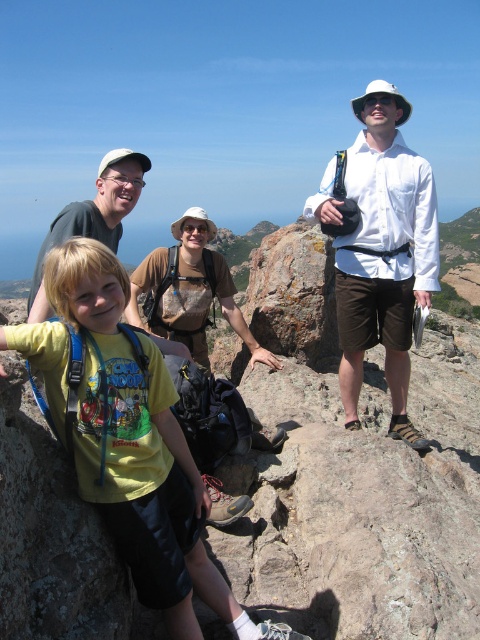
Is white cotton shirt at center below matte green shirt at center?

Yes, white cotton shirt at center is below matte green shirt at center.

Does white cotton shirt at center come in front of matte green shirt at center?

No, it is behind matte green shirt at center.

This screenshot has height=640, width=480. What are the coordinates of `white cotton shirt at center` in the screenshot? It's located at [x=381, y=250].

Is yellow cotton shirt at center to the left of matte green shirt at center from the viewer's perspective?

In fact, yellow cotton shirt at center is to the right of matte green shirt at center.

Between point (146, 460) and point (130, 157), which one is positioned behind?

Point (130, 157)

Where is `yellow cotton shirt at center`? yellow cotton shirt at center is located at coordinates (130, 442).

Is point (118, 385) farther from camera compared to point (360, 131)?

No, (118, 385) is closer to viewer.

Is yellow cotton shirt at center thinner than white cotton shirt at center?

Correct, yellow cotton shirt at center's width is less than white cotton shirt at center's.

I want to click on yellow cotton shirt at center, so click(130, 442).